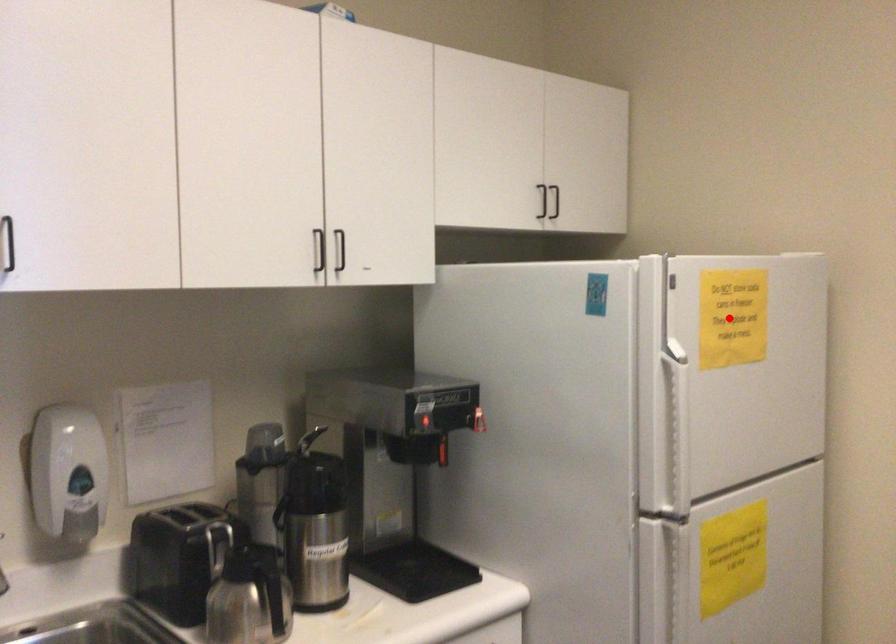
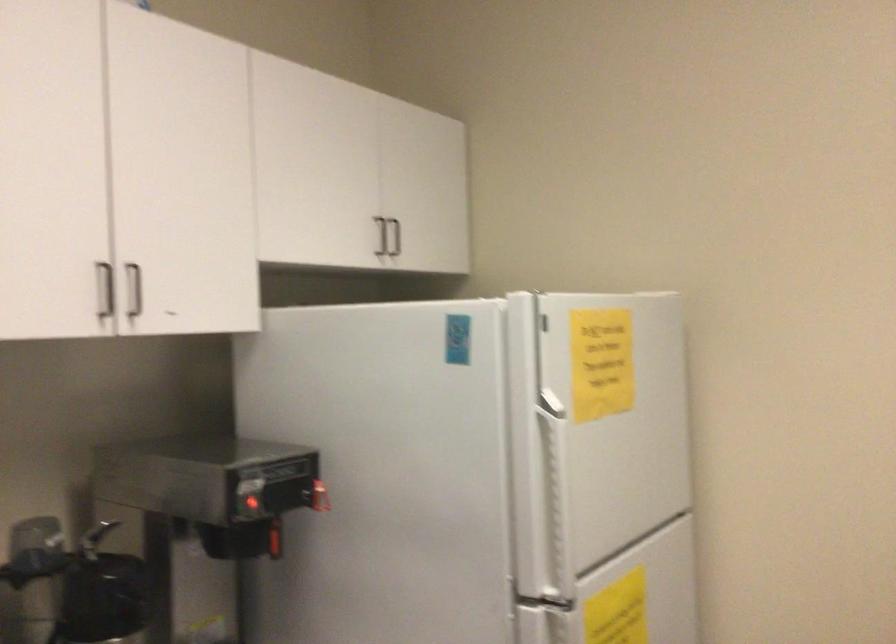
Question: I am providing you with two images of the same scene from different viewpoints. A red point is shown in image1. For the corresponding object point in image2, is it positioned nearer or farther from the camera?

Choices:
 (A) Nearer
 (B) Farther

Answer: (A)